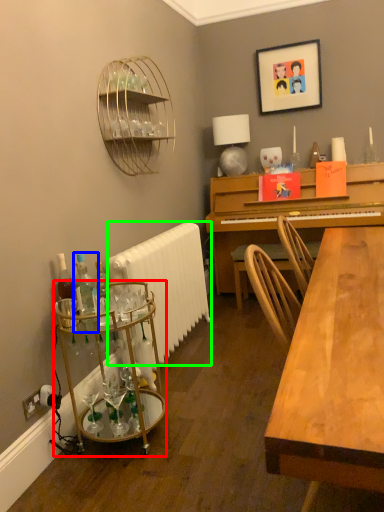
Question: Considering the real-world distances, which object is closest to table (highlighted by a red box)? bottle (highlighted by a blue box) or radiator (highlighted by a green box).

Choices:
 (A) bottle
 (B) radiator

Answer: (A)